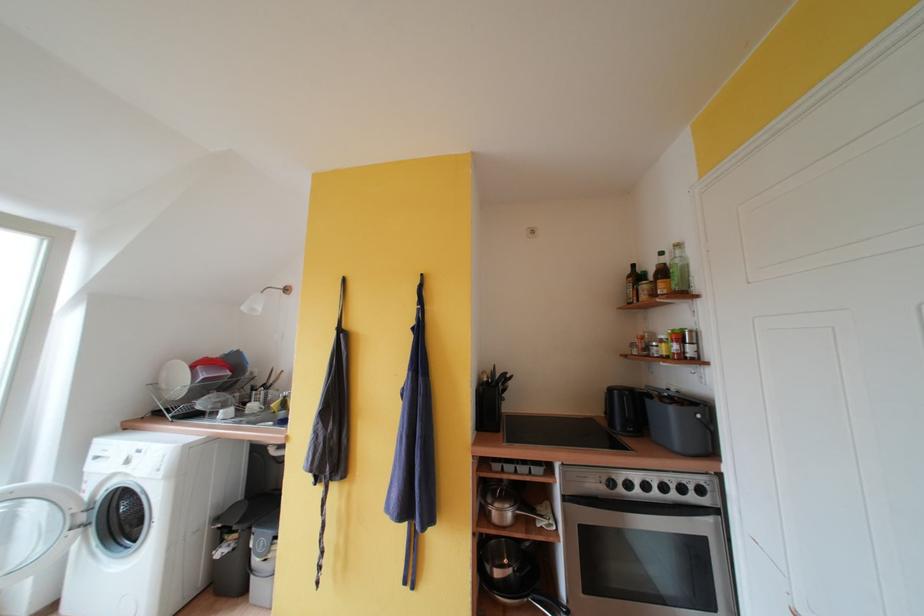
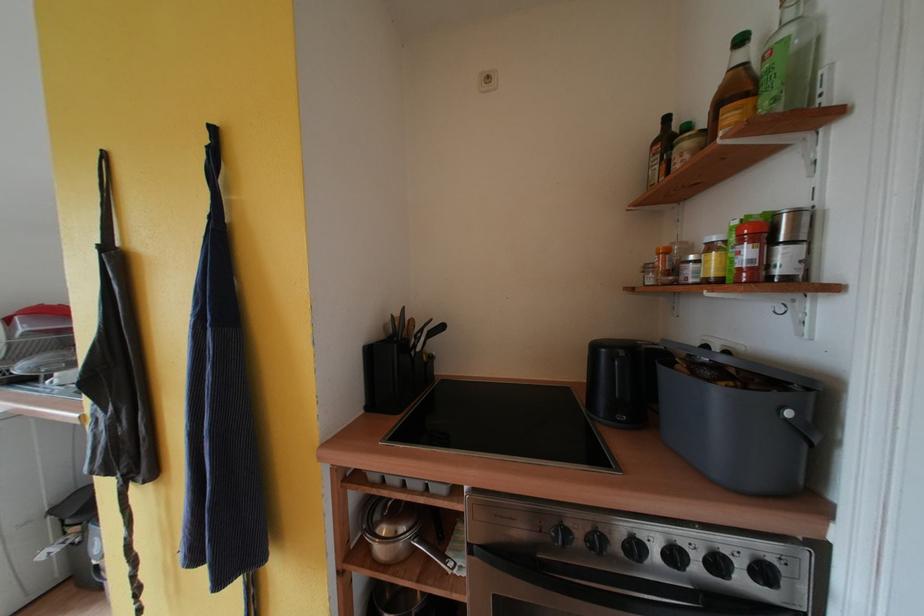
In the second image, find the point that corresponds to point (708, 495) in the first image.

(771, 577)